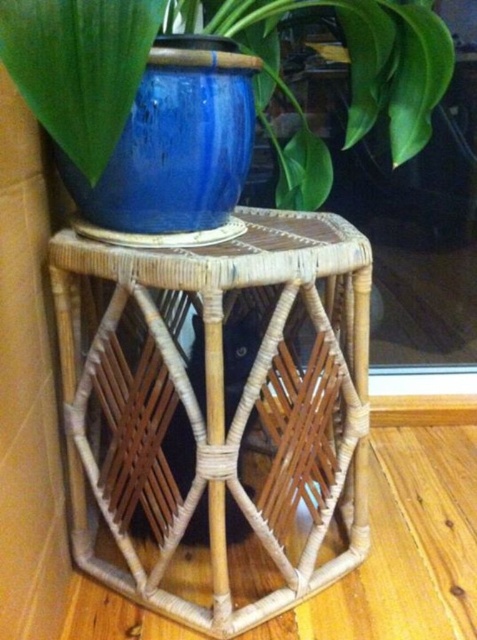
Is the position of natural woven table at center more distant than that of blue ceramic vase at center?

Yes, it is.

Which is more to the left, natural woven table at center or blue ceramic vase at center?

blue ceramic vase at center is more to the left.

Does point (344, 268) lie in front of point (148, 52)?

That is False.

At what (x,y) coordinates should I click in order to perform the action: click on natural woven table at center. Please return your answer as a coordinate pair (x, y). Looking at the image, I should click on (217, 413).

Does natural woven table at center appear on the left side of blue ceramic pot at upper center?

Correct, you'll find natural woven table at center to the left of blue ceramic pot at upper center.

Between natural woven table at center and blue ceramic pot at upper center, which one is positioned lower?

natural woven table at center is lower down.

Describe the element at coordinates (217, 413) in the screenshot. Image resolution: width=477 pixels, height=640 pixels. I see `natural woven table at center` at that location.

The image size is (477, 640). In order to click on natural woven table at center in this screenshot , I will do `click(217, 413)`.

Who is shorter, blue ceramic pot at upper center or blue ceramic vase at center?

Answer: With less height is blue ceramic vase at center.

Describe the element at coordinates (79, 67) in the screenshot. I see `blue ceramic pot at upper center` at that location.

Locate an element on the screen. blue ceramic pot at upper center is located at coordinates (79, 67).